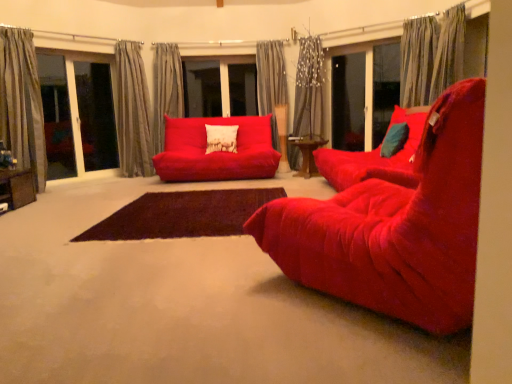
At what (x,y) coordinates should I click in order to perform the action: click on vacant area that is in front of brown rug at center. Please return your answer as a coordinate pair (x, y). Image resolution: width=512 pixels, height=384 pixels. Looking at the image, I should click on (157, 283).